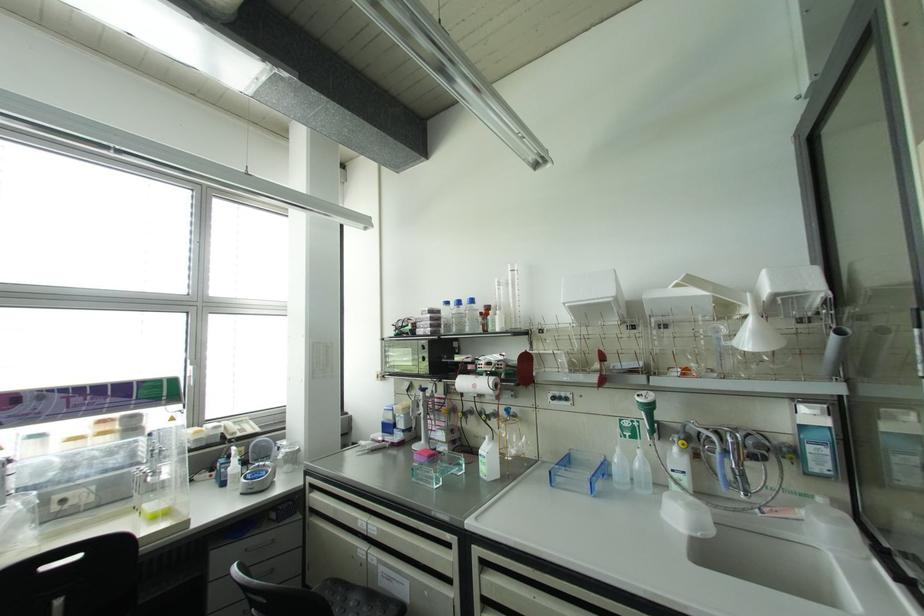
What do you see at coordinates (647, 411) in the screenshot?
I see `the green tool handle` at bounding box center [647, 411].